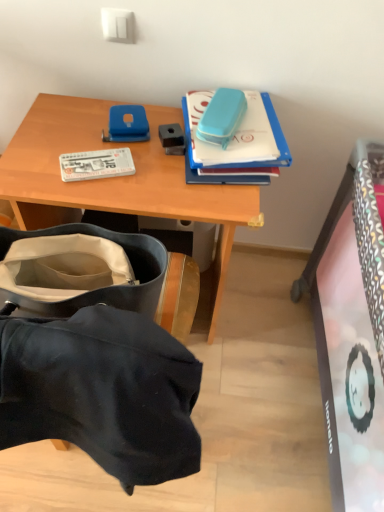
This screenshot has height=512, width=384. I want to click on vacant area that is in front of white matte book at left, the 1th book when ordered from left to right, so click(x=95, y=187).